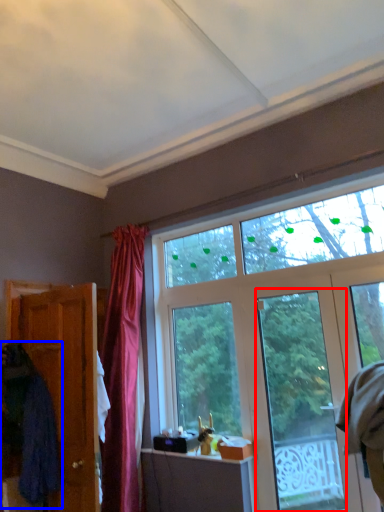
Question: Among these objects, which one is nearest to the camera, glass door (highlighted by a red box) or robe (highlighted by a blue box)?

Choices:
 (A) glass door
 (B) robe

Answer: (B)